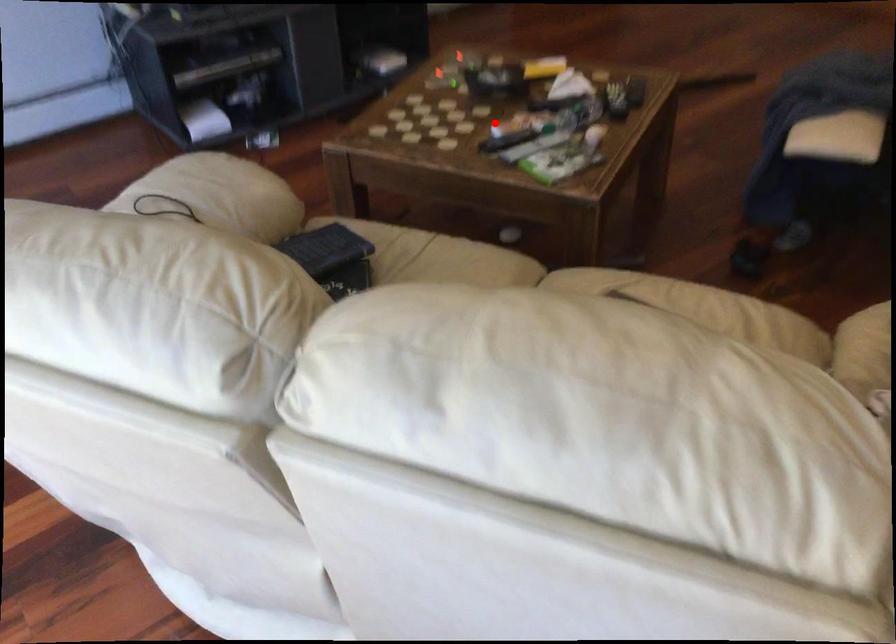
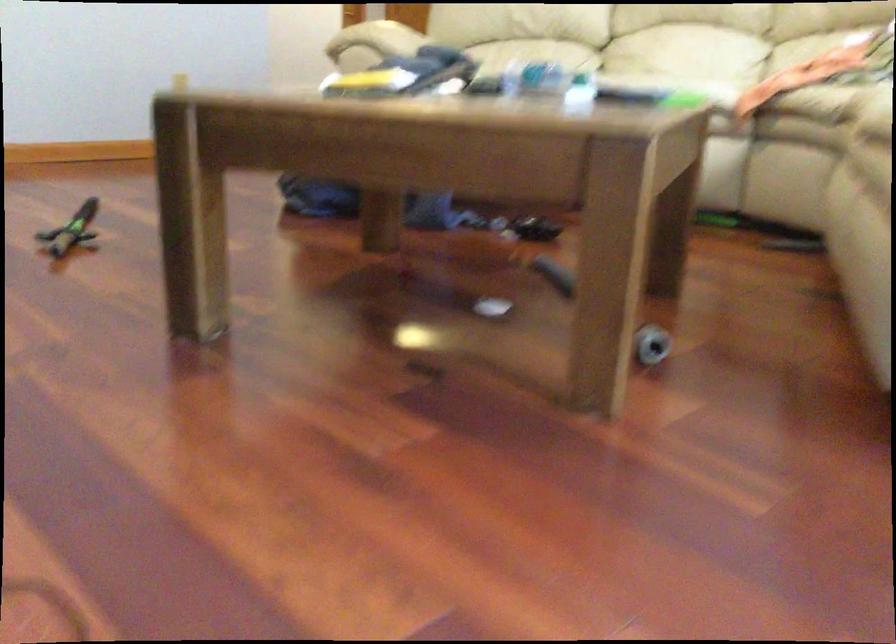
Question: I am providing you with two images of the same scene from different viewpoints. Image1 has a red point marked. In image2, the corresponding 3D location appears at what relative position? Reply with the corresponding letter.

Choices:
 (A) Closer
 (B) Farther

Answer: (A)